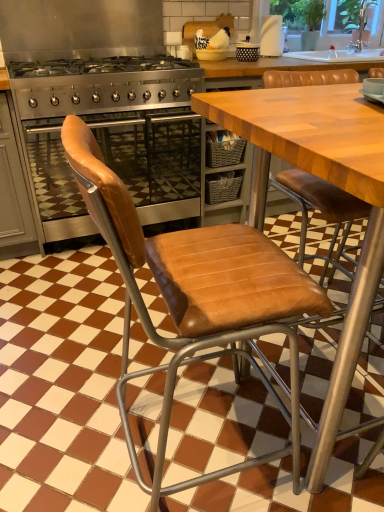
Question: Looking at their shapes, would you say stainless steel oven at left is wider or thinner than white matte paper towel at upper right?

Choices:
 (A) wide
 (B) thin

Answer: (A)

Question: From a real-world perspective, relative to white matte paper towel at upper right, is stainless steel oven at left vertically above or below?

Choices:
 (A) below
 (B) above

Answer: (A)

Question: Estimate the real-world distances between objects in this image. Which object is closer to the brown leather chair at left?

Choices:
 (A) stainless steel gas stove at center
 (B) transparent glass window screen at upper right
 (C) stainless steel oven at left
 (D) satin silver oven at left
 (E) white matte paper towel at upper right

Answer: (C)

Question: Which object is the closest to the stainless steel gas stove at center?

Choices:
 (A) satin silver oven at left
 (B) brown leather chair at left
 (C) white matte paper towel at upper right
 (D) transparent glass window screen at upper right
 (E) stainless steel oven at left

Answer: (E)